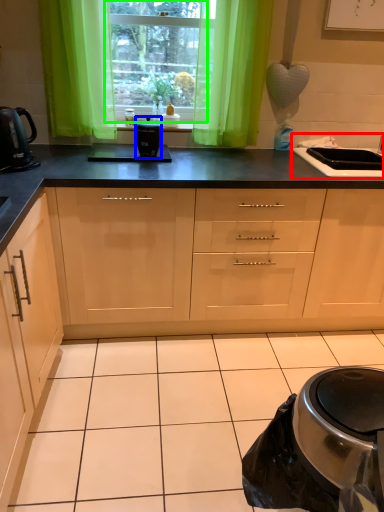
Question: Considering the real-world distances, which object is closest to sink (highlighted by a red box)? kitchen appliance (highlighted by a blue box) or window (highlighted by a green box).

Choices:
 (A) kitchen appliance
 (B) window

Answer: (A)